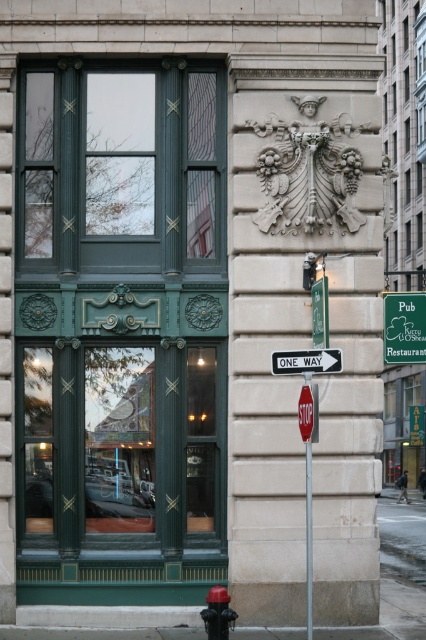
Who is taller, red plastic fire hydrant at lower center or metallic pole at center?

metallic pole at center is taller.

Identify the location of red plastic fire hydrant at lower center. (218, 612).

Where is `red plastic fire hydrant at lower center`? red plastic fire hydrant at lower center is located at coordinates [218, 612].

Can you confirm if metallic pole at center is wider than red painted metal stop sign at center?

Incorrect, metallic pole at center's width does not surpass red painted metal stop sign at center's.

Describe the element at coordinates (308, 540) in the screenshot. I see `metallic pole at center` at that location.

Where is `metallic pole at center`? This screenshot has width=426, height=640. metallic pole at center is located at coordinates click(308, 540).

Which is more to the left, metallic pole at center or green plastic street sign at center-right?

Positioned to the left is metallic pole at center.

Who is more forward, (310,560) or (324,291)?

Point (324,291)

Locate an element on the screen. This screenshot has width=426, height=640. metallic pole at center is located at coordinates (308, 540).